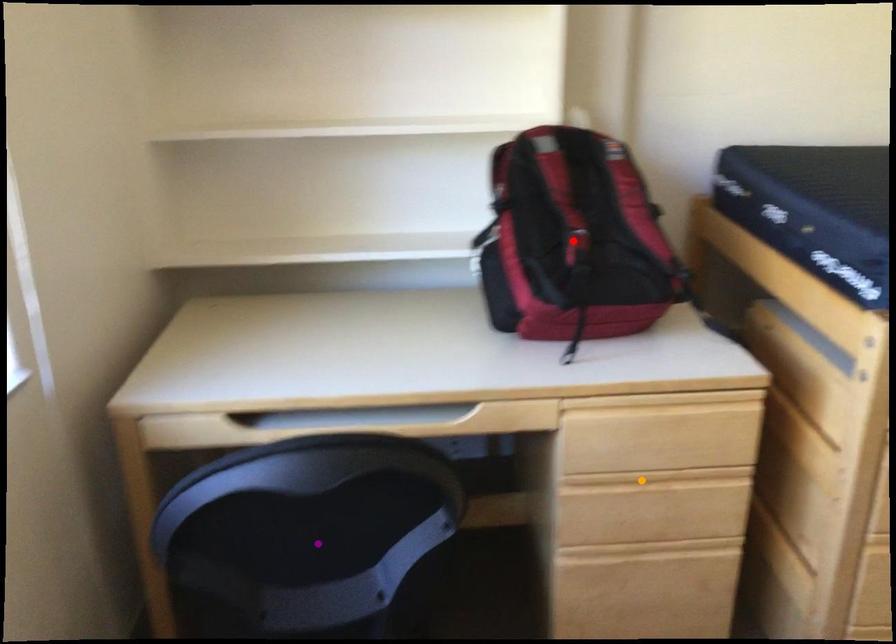
Order these from nearest to farthest:
- orange point
- purple point
- red point

purple point, orange point, red point